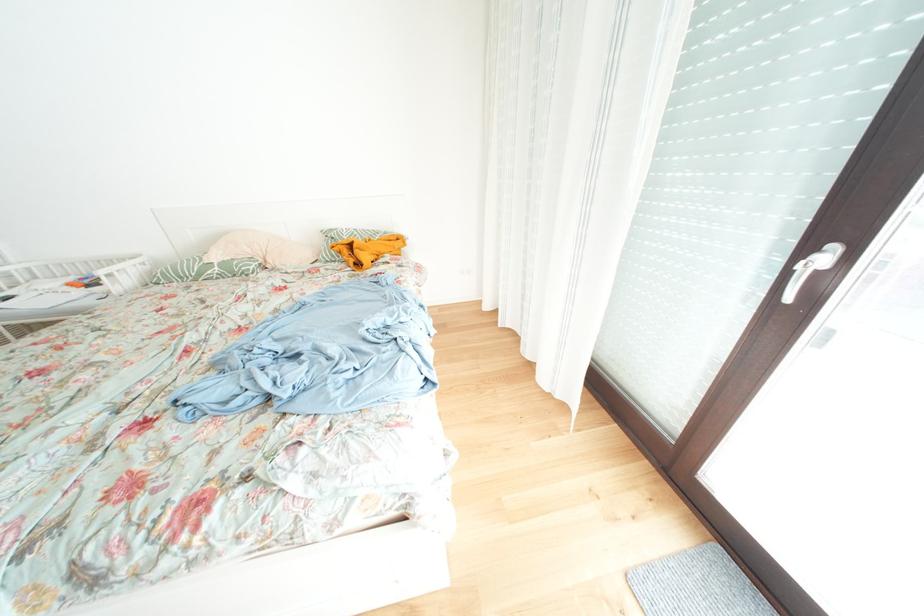
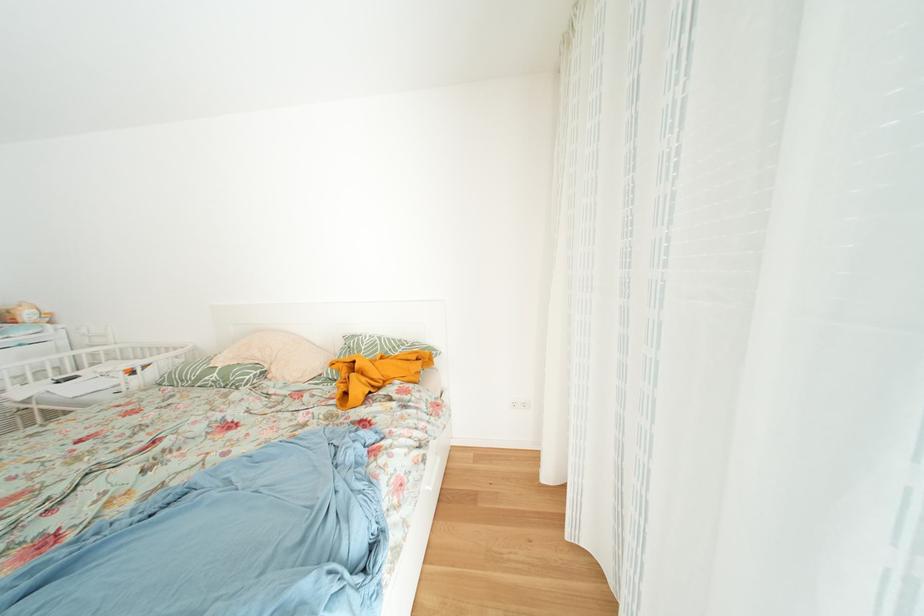
In the second image, find the point that corresponds to point 210,280 in the first image.

(208, 384)